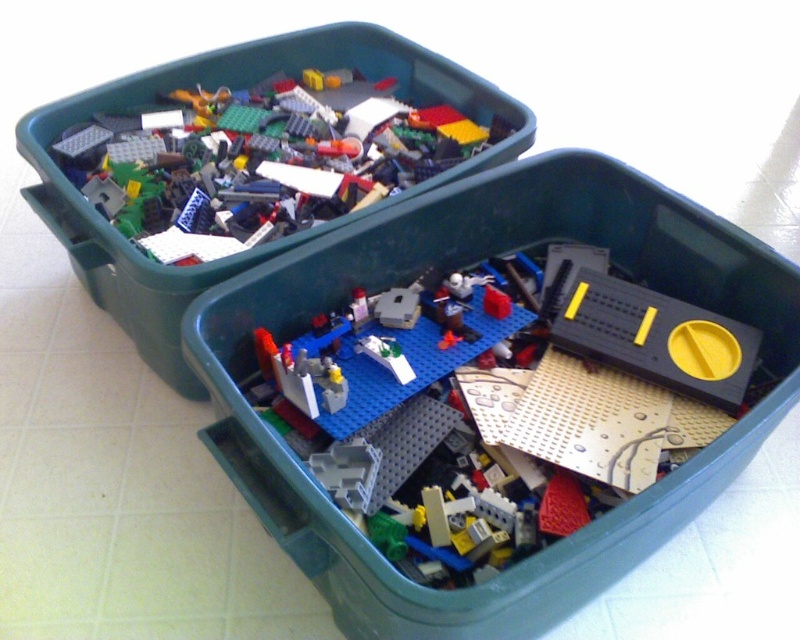
Question: Can you confirm if translucent plastic bricks at upper left is thinner than matte plastic lego bricks at upper left?

Choices:
 (A) yes
 (B) no

Answer: (A)

Question: Which object is closer to the camera taking this photo?

Choices:
 (A) blue plastic baseplate at center
 (B) matte plastic lego bricks at upper left

Answer: (A)

Question: Does blue plastic baseplate at center have a smaller size compared to matte plastic lego bricks at upper left?

Choices:
 (A) yes
 (B) no

Answer: (A)

Question: Which object appears closest to the camera in this image?

Choices:
 (A) matte plastic lego bricks at upper left
 (B) translucent plastic bricks at upper left

Answer: (A)

Question: Does blue plastic baseplate at center appear over translucent plastic bricks at upper left?

Choices:
 (A) yes
 (B) no

Answer: (B)

Question: Among these objects, which one is nearest to the camera?

Choices:
 (A) translucent plastic bricks at upper left
 (B) matte plastic lego bricks at upper left
 (C) blue plastic baseplate at center

Answer: (C)